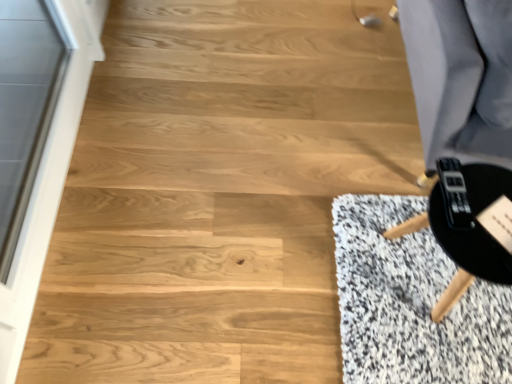
Question: From the image's perspective, is transparent glass screen door at left below black matte round table at lower right?

Choices:
 (A) yes
 (B) no

Answer: (B)

Question: Is transparent glass screen door at left not within black matte round table at lower right?

Choices:
 (A) no
 (B) yes

Answer: (B)

Question: Is transparent glass screen door at left shorter than black matte round table at lower right?

Choices:
 (A) yes
 (B) no

Answer: (B)

Question: Does transparent glass screen door at left have a larger size compared to black matte round table at lower right?

Choices:
 (A) no
 (B) yes

Answer: (B)

Question: Is transparent glass screen door at left wider than black matte round table at lower right?

Choices:
 (A) yes
 (B) no

Answer: (B)

Question: Would you say transparent glass screen door at left is inside or outside black matte round table at lower right?

Choices:
 (A) outside
 (B) inside

Answer: (A)

Question: In terms of height, does transparent glass screen door at left look taller or shorter compared to black matte round table at lower right?

Choices:
 (A) short
 (B) tall

Answer: (B)

Question: From a real-world perspective, is transparent glass screen door at left positioned above or below black matte round table at lower right?

Choices:
 (A) above
 (B) below

Answer: (A)

Question: Is transparent glass screen door at left bigger or smaller than black matte round table at lower right?

Choices:
 (A) small
 (B) big

Answer: (B)

Question: From their relative heights in the image, would you say black matte round table at lower right is taller or shorter than transparent glass screen door at left?

Choices:
 (A) tall
 (B) short

Answer: (B)

Question: Is black matte round table at lower right in front of or behind transparent glass screen door at left in the image?

Choices:
 (A) behind
 (B) front

Answer: (A)

Question: From the image's perspective, is black matte round table at lower right located above or below transparent glass screen door at left?

Choices:
 (A) below
 (B) above

Answer: (A)

Question: In terms of size, does black matte round table at lower right appear bigger or smaller than transparent glass screen door at left?

Choices:
 (A) big
 (B) small

Answer: (B)

Question: Is black matte game controller at lower right to the left or to the right of transparent glass screen door at left in the image?

Choices:
 (A) right
 (B) left

Answer: (A)

Question: From a real-world perspective, is black matte game controller at lower right above or below transparent glass screen door at left?

Choices:
 (A) above
 (B) below

Answer: (A)